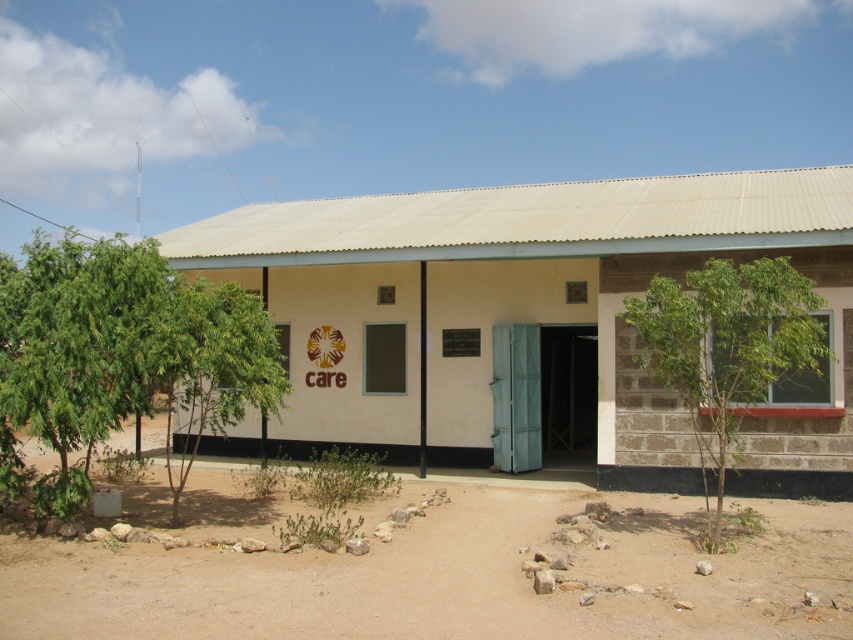
Does point (584, 189) come behind point (262, 577)?

Yes, it is.

At what (x,y) coordinates should I click in order to perform the action: click on white matte building at center. Please return your answer as a coordinate pair (x, y). Looking at the image, I should click on (532, 321).

Does white matte building at center appear under green leafy tree at right?

Incorrect, white matte building at center is not positioned below green leafy tree at right.

Can you confirm if white matte building at center is positioned to the left of green leafy tree at right?

Indeed, white matte building at center is positioned on the left side of green leafy tree at right.

Find the location of `white matte building at center`. white matte building at center is located at coordinates (532, 321).

Where is `white matte building at center`? white matte building at center is located at coordinates (532, 321).

Who is positioned more to the right, brown sandy dirt at lower center or green leafy tree at right?

Positioned to the right is green leafy tree at right.

Which is more to the left, brown sandy dirt at lower center or green leafy tree at right?

From the viewer's perspective, brown sandy dirt at lower center appears more on the left side.

Is point (517, 604) farther from camera compared to point (695, 317)?

No, it is not.

Image resolution: width=853 pixels, height=640 pixels. I want to click on brown sandy dirt at lower center, so click(x=442, y=573).